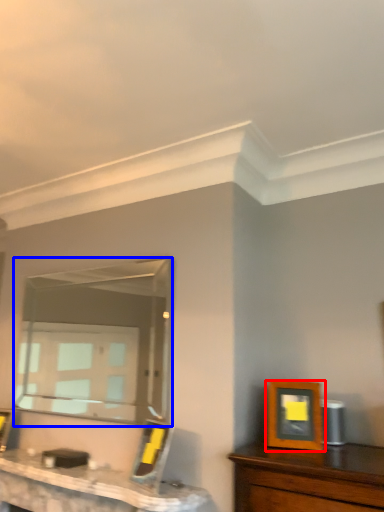
Question: Which object appears farthest to the camera in this image, picture frame (highlighted by a red box) or mirror (highlighted by a blue box)?

Choices:
 (A) picture frame
 (B) mirror

Answer: (B)